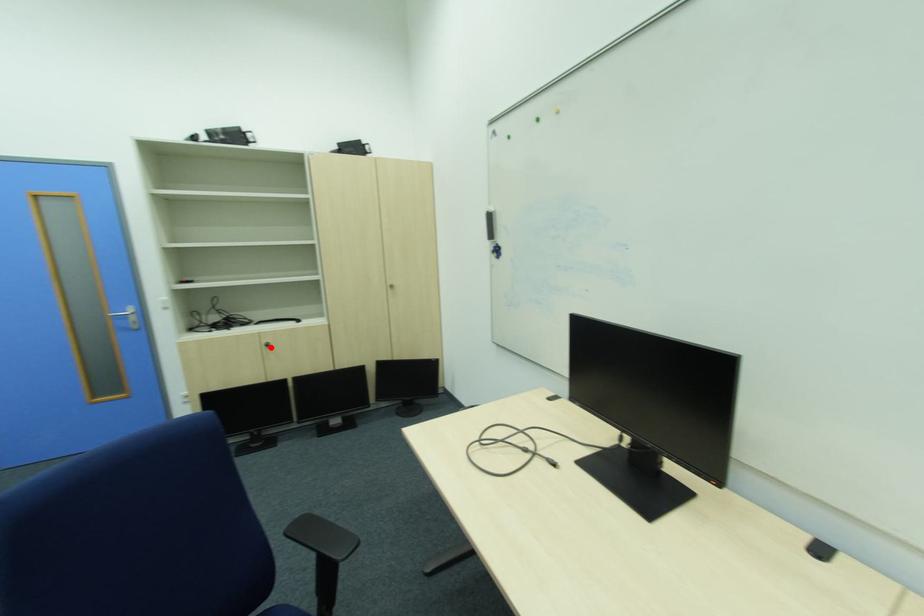
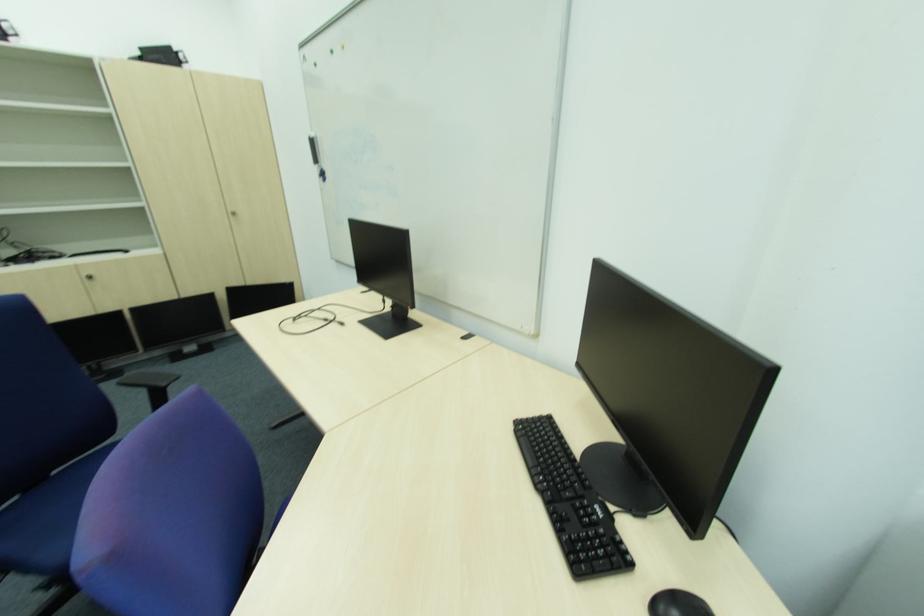
Locate, in the second image, the point that corresponds to the highlighted location in the first image.

(92, 280)